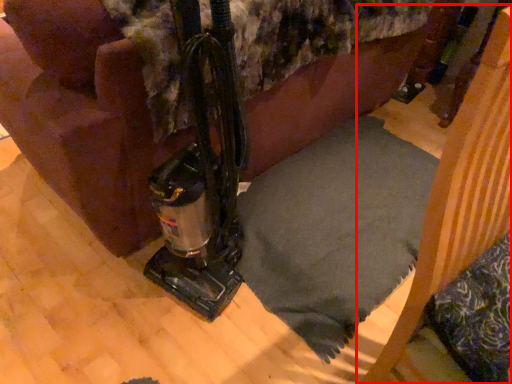
Question: From the image's perspective, what is the correct spatial positioning of furniture (annotated by the red box) in reference to pillow?

Choices:
 (A) above
 (B) below

Answer: (A)